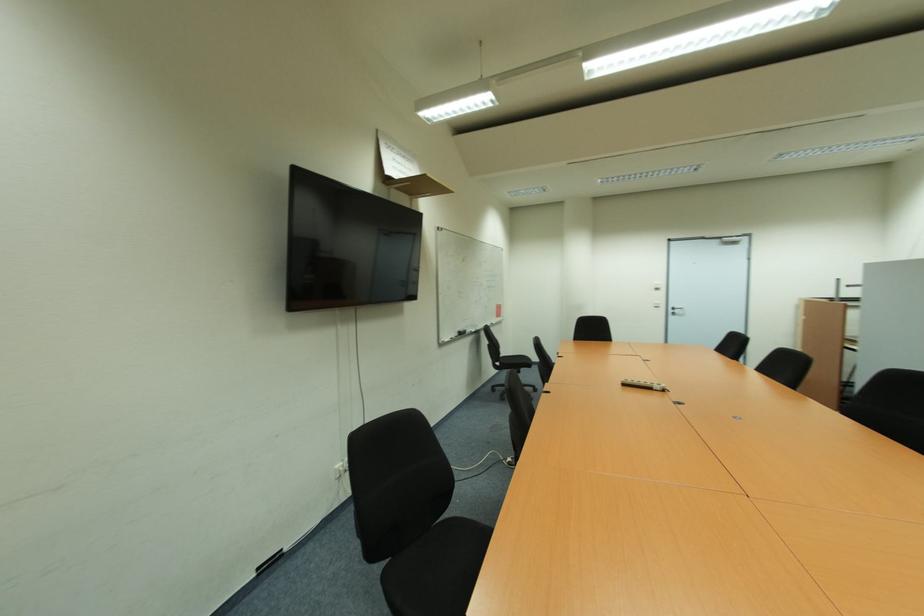
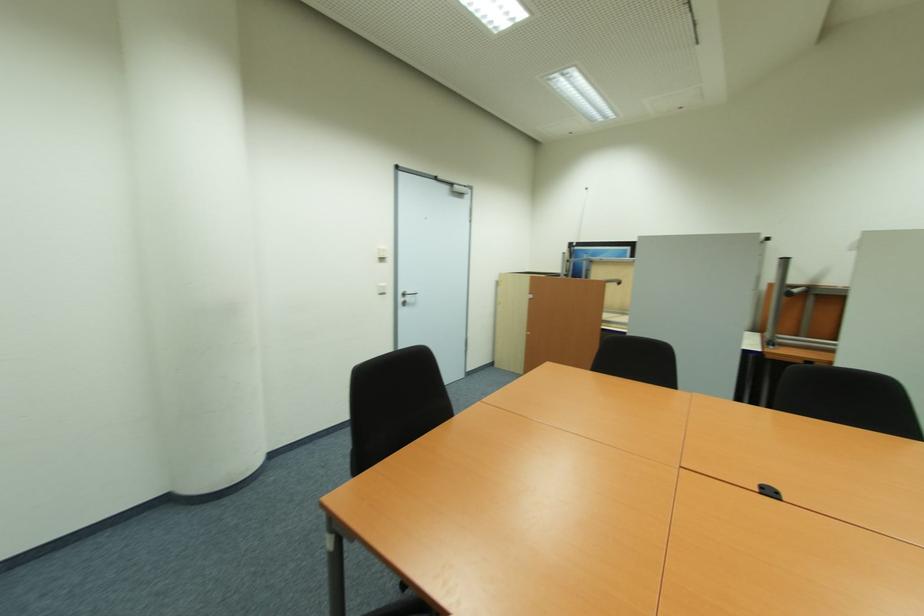
The point at (660, 290) is marked in the first image. Where is the corresponding point in the second image?

(385, 260)